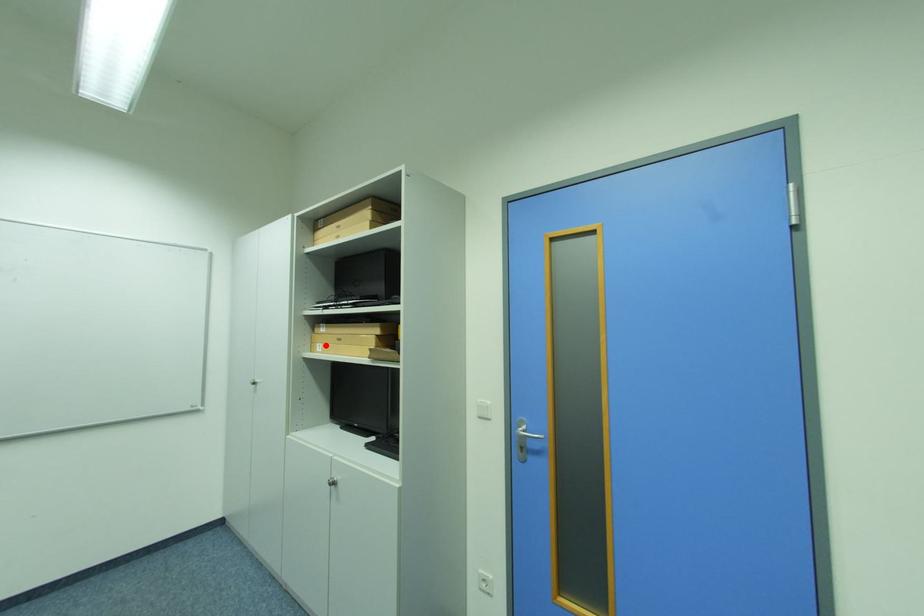
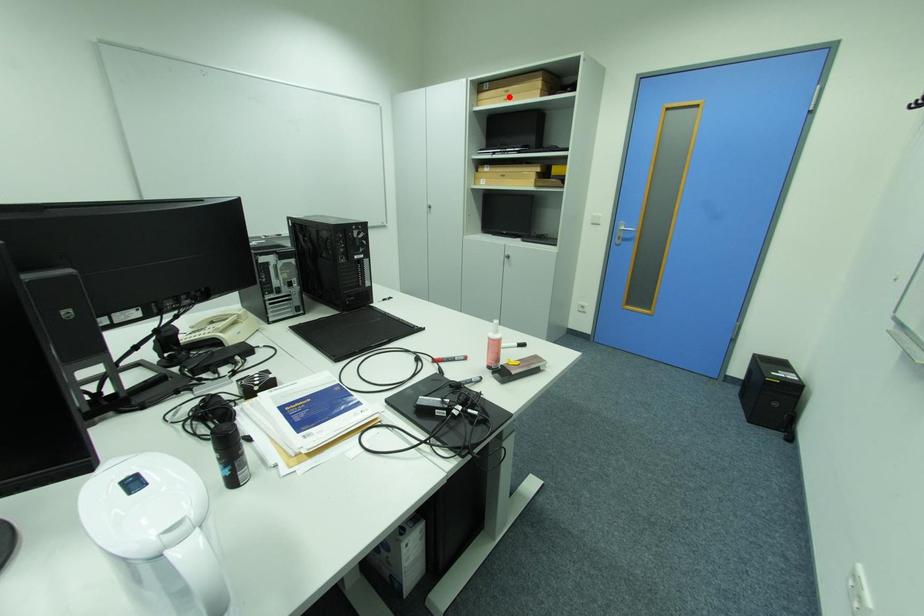
I am providing you with two images of the same scene from different viewpoints. A red point is marked on the first image and another point is marked on the second image. Do the highlighted points in image1 and image2 indicate the same real-world spot?

No